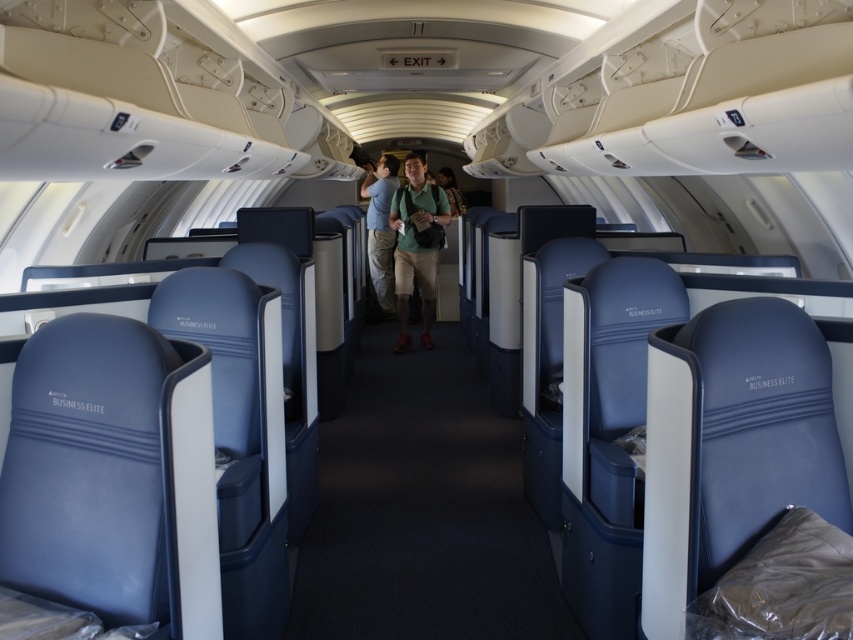
Is point (405, 349) closer to viewer compared to point (387, 284)?

Yes, point (405, 349) is in front of point (387, 284).

Who is more forward, (401, 300) or (381, 216)?

Point (401, 300) is in front.

Who is more distant from viewer, (396,304) or (373,241)?

The point (373,241) is more distant.

Locate an element on the screen. green fabric shirt at center is located at coordinates (416, 244).